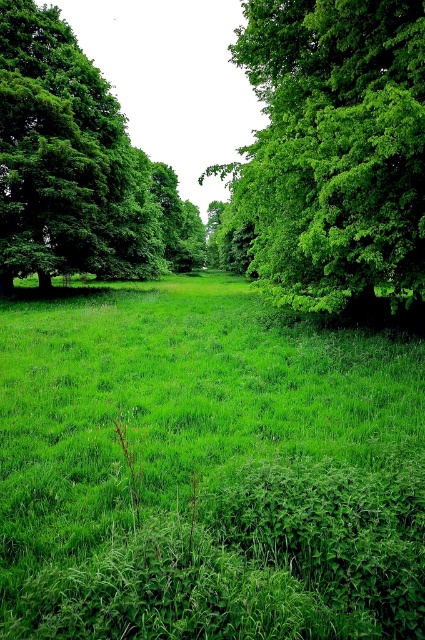
Question: Among these points, which one is nearest to the camera?

Choices:
 (A) (266, 540)
 (B) (65, 157)
 (C) (320, 51)

Answer: (A)

Question: Which of these objects is positioned farthest from the green leafy tree at left?

Choices:
 (A) green grassy at center
 (B) green leafy tree at center

Answer: (A)

Question: Can you confirm if green leafy tree at center is bigger than green leafy tree at left?

Choices:
 (A) no
 (B) yes

Answer: (A)

Question: Can you confirm if green grassy at center is positioned to the left of green leafy tree at center?

Choices:
 (A) no
 (B) yes

Answer: (B)

Question: In this image, where is green grassy at center located relative to green leafy tree at left?

Choices:
 (A) below
 (B) above

Answer: (A)

Question: Which object is the closest to the green leafy tree at center?

Choices:
 (A) green grassy at center
 (B) green leafy tree at left

Answer: (A)